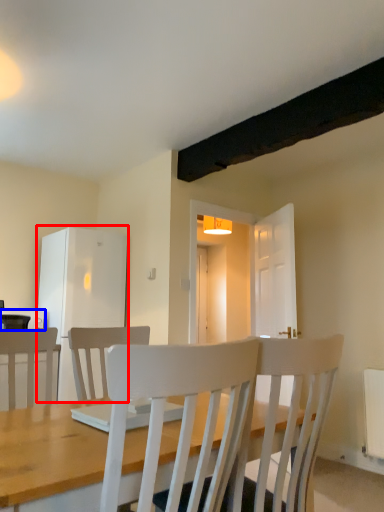
Question: Which of the following is the farthest to the observer, fridge (highlighted by a red box) or appliance (highlighted by a blue box)?

Choices:
 (A) fridge
 (B) appliance

Answer: (A)